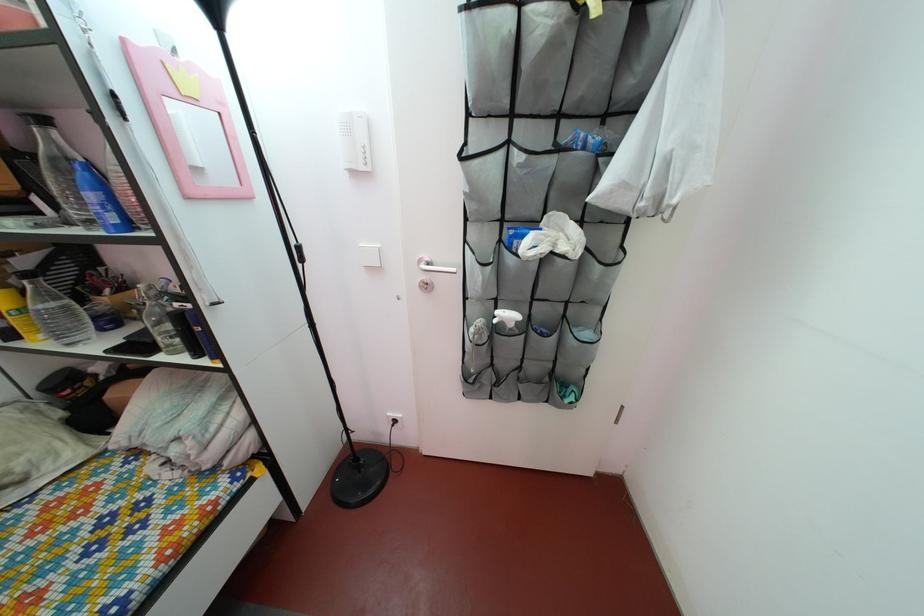
Image resolution: width=924 pixels, height=616 pixels. Describe the element at coordinates (432, 265) in the screenshot. I see `a silver door handle` at that location.